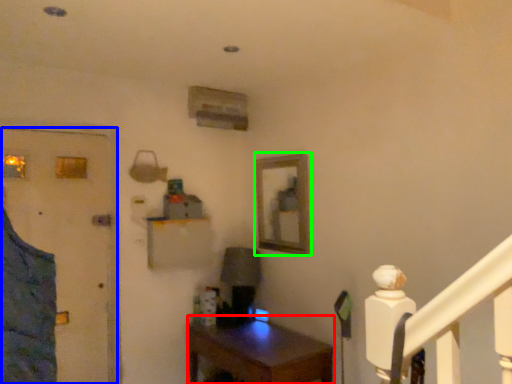
Question: Which object is the farthest from desk (highlighted by a red box)? Choose among these: door (highlighted by a blue box) or picture frame (highlighted by a green box).

Choices:
 (A) door
 (B) picture frame

Answer: (A)